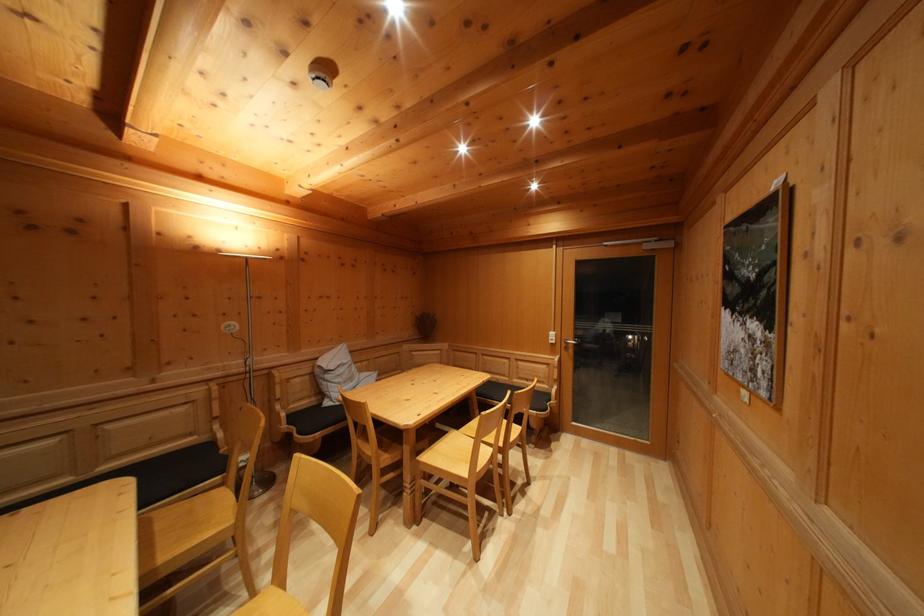
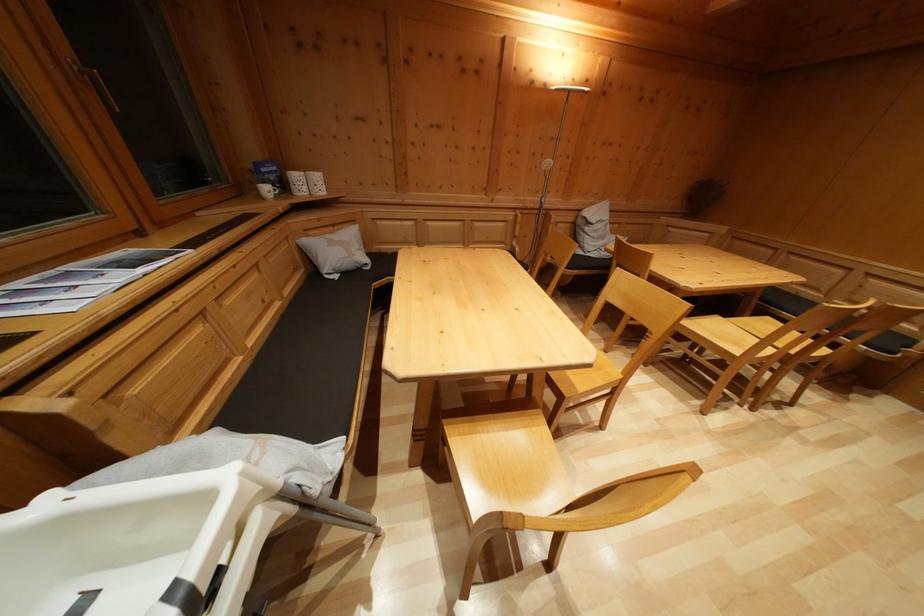
First-person continuous shooting, in which direction is the camera rotating?

The rotation direction of the camera is left-down.